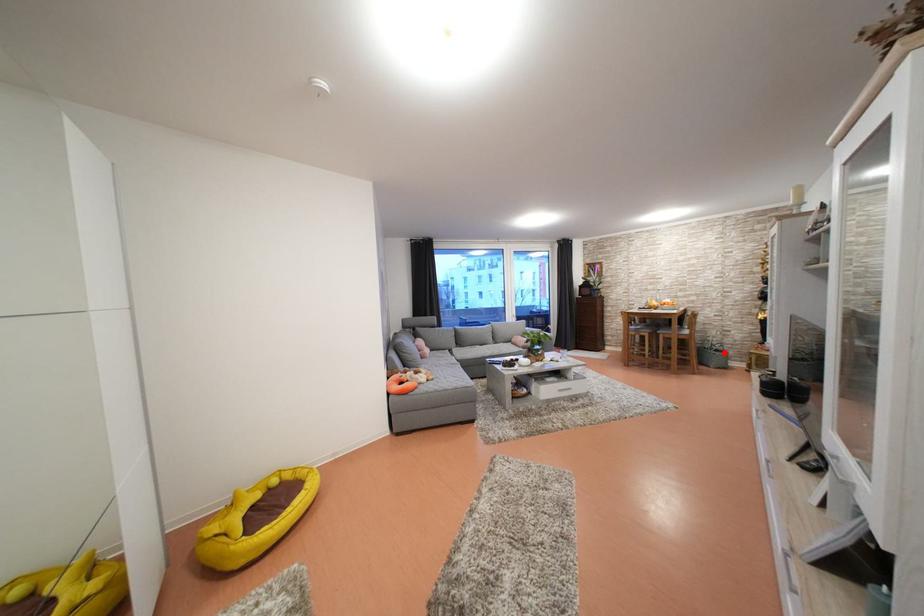
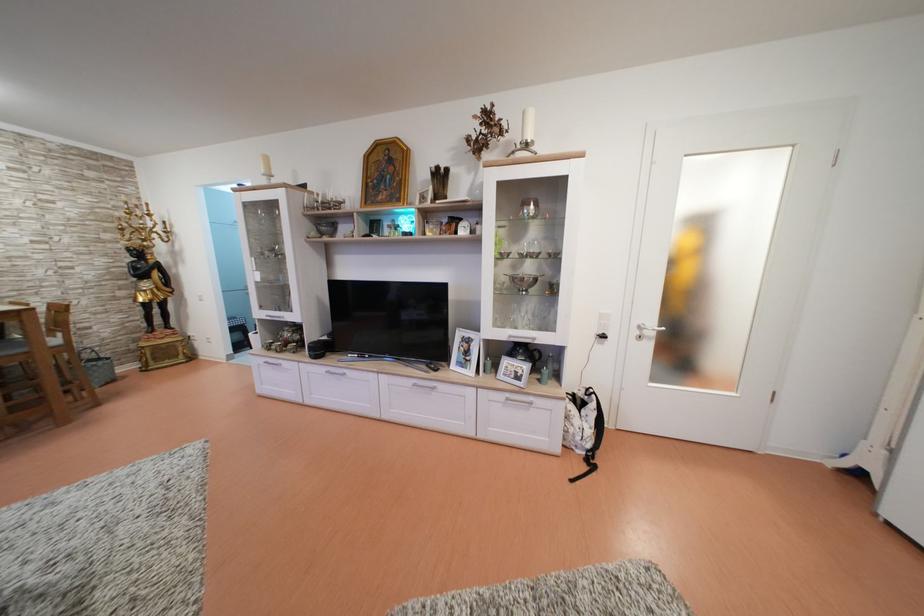
Question: I am providing you with two images of the same scene from different viewpoints. Given a red point in image1, look at the same physical point in image2. Is it:

Choices:
 (A) Closer to the viewpoint
 (B) Farther from the viewpoint

Answer: (B)